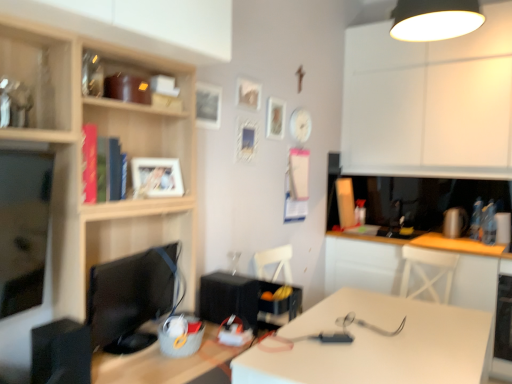
Question: Looking at their shapes, would you say black matte speaker at center, marked as the 1th appliance in a right-to-left arrangement, is wider or thinner than black plastic speaker at left, the 1th appliance viewed from the left?

Choices:
 (A) thin
 (B) wide

Answer: (B)

Question: Considering the positions of point (254, 299) and point (61, 365), is point (254, 299) closer or farther from the camera than point (61, 365)?

Choices:
 (A) farther
 (B) closer

Answer: (A)

Question: Based on their relative distances, which object is nearer to the wooden picture frame at upper center, which is counted as the first picture frame, starting from the right?

Choices:
 (A) black plastic speaker at left, which ranks as the second appliance in back-to-front order
 (B) white matte picture frame at upper center, the 4th picture frame viewed from the left
 (C) black matte speaker at center, the 2th appliance in the left-to-right sequence
 (D) matte wood cabinet at left, which is the 1th cabinetry from front to back
 (E) black glossy monitor at left

Answer: (B)

Question: Estimate the real-world distances between objects in this image. Which object is closer to the white glossy picture frame at upper center, which appears as the second picture frame when viewed from the back?

Choices:
 (A) wooden picture frame at upper center, the fifth picture frame from the left
 (B) matte wood cabinet at left, which is the 1th cabinetry from front to back
 (C) white matte cabinet at upper right, placed as the second cabinetry when sorted from left to right
 (D) wooden photo frame at upper center, the 4th picture frame positioned from the right
 (E) black matte speaker at center, marked as the 1th appliance in a right-to-left arrangement

Answer: (A)